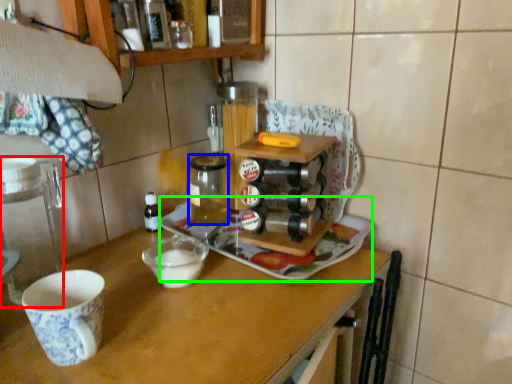
Question: Estimate the real-world distances between objects in this image. Which object is farther from appliance (highlighted by a red box), beverage (highlighted by a blue box) or tray (highlighted by a green box)?

Choices:
 (A) beverage
 (B) tray

Answer: (B)